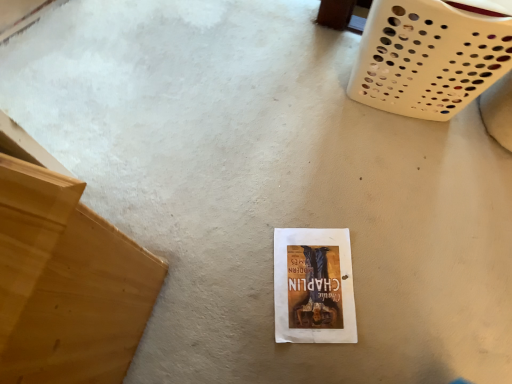
Question: Is white plastic basket at upper right far away from white paper at center?

Choices:
 (A) no
 (B) yes

Answer: (A)

Question: From a real-world perspective, is white plastic basket at upper right on white paper at center?

Choices:
 (A) yes
 (B) no

Answer: (A)

Question: Are white plastic basket at upper right and white paper at center beside each other?

Choices:
 (A) no
 (B) yes

Answer: (A)

Question: Does white plastic basket at upper right have a greater height compared to white paper at center?

Choices:
 (A) yes
 (B) no

Answer: (A)

Question: Can white paper at center be found inside white plastic basket at upper right?

Choices:
 (A) no
 (B) yes

Answer: (A)

Question: Do you think white paper at center is within light brown wood at left, or outside of it?

Choices:
 (A) inside
 (B) outside

Answer: (B)

Question: In the image, is white paper at center positioned in front of or behind light brown wood at left?

Choices:
 (A) behind
 (B) front

Answer: (A)

Question: Is white paper at center taller or shorter than light brown wood at left?

Choices:
 (A) short
 (B) tall

Answer: (A)

Question: Is point (313, 337) positioned closer to the camera than point (92, 221)?

Choices:
 (A) closer
 (B) farther

Answer: (B)

Question: Is light brown wood at left inside the boundaries of white plastic basket at upper right, or outside?

Choices:
 (A) inside
 (B) outside

Answer: (B)

Question: Is point (121, 334) closer or farther from the camera than point (395, 89)?

Choices:
 (A) closer
 (B) farther

Answer: (A)

Question: Considering their positions, is light brown wood at left located in front of or behind white plastic basket at upper right?

Choices:
 (A) front
 (B) behind

Answer: (A)

Question: From the image's perspective, relative to white plastic basket at upper right, is light brown wood at left above or below?

Choices:
 (A) below
 (B) above

Answer: (A)

Question: From a real-world perspective, relative to white paper at center, is white plastic basket at upper right vertically above or below?

Choices:
 (A) below
 (B) above

Answer: (B)

Question: Is point (482, 18) closer or farther from the camera than point (315, 264)?

Choices:
 (A) farther
 (B) closer

Answer: (B)